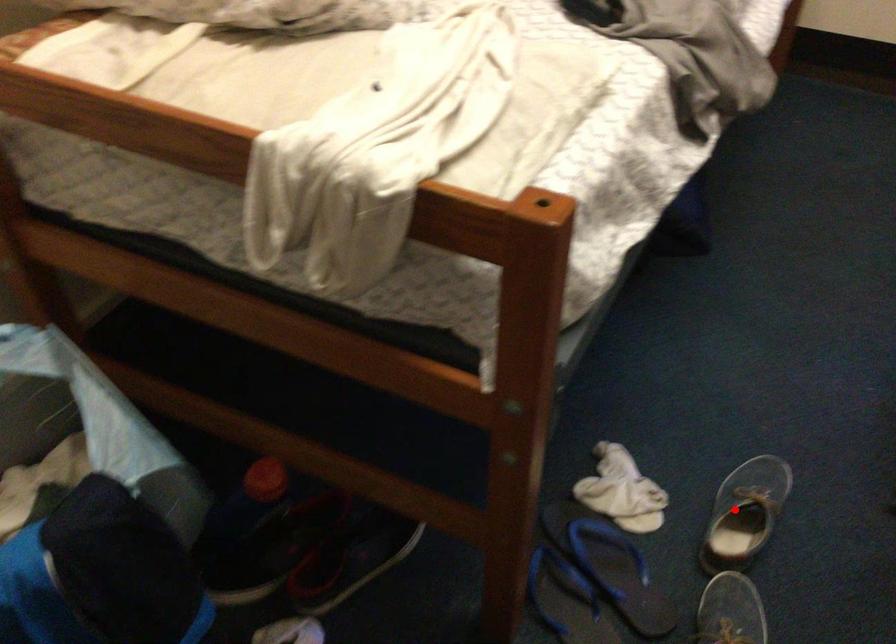
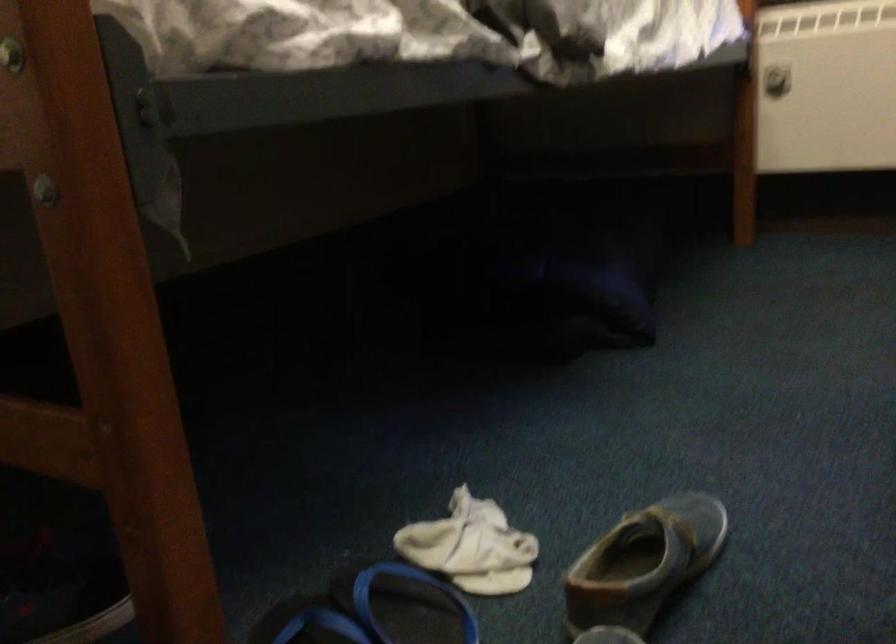
Where in the second image is the point corresponding to the highlighted location from the first image?

(643, 563)